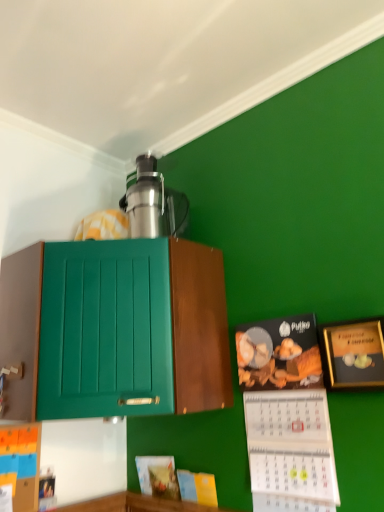
Question: Is point (155, 178) positioned closer to the camera than point (110, 349)?

Choices:
 (A) closer
 (B) farther

Answer: (B)

Question: Looking at their shapes, would you say satin silver thermos at upper center is wider or thinner than green matte cabinet at upper left?

Choices:
 (A) wide
 (B) thin

Answer: (B)

Question: Which is farther from the matte black calendar at lower right, which ranks as the 1th book in right-to-left order?

Choices:
 (A) gold-framed picture at upper right
 (B) orange matte board at lower left, arranged as the 1th book when viewed from the left
 (C) matte paper book at lower center, which ranks as the third book in right-to-left order
 (D) green matte cabinet at upper left
 (E) matte yellow book at lower center, the 2th book when ordered from right to left

Answer: (B)

Question: Which is farther from the matte paper book at lower center, which ranks as the third book in right-to-left order?

Choices:
 (A) satin silver thermos at upper center
 (B) gold-framed picture at upper right
 (C) green matte cabinet at upper left
 (D) matte black calendar at lower right, which ranks as the 1th book in right-to-left order
 (E) matte yellow book at lower center, the 2th book when ordered from right to left

Answer: (A)